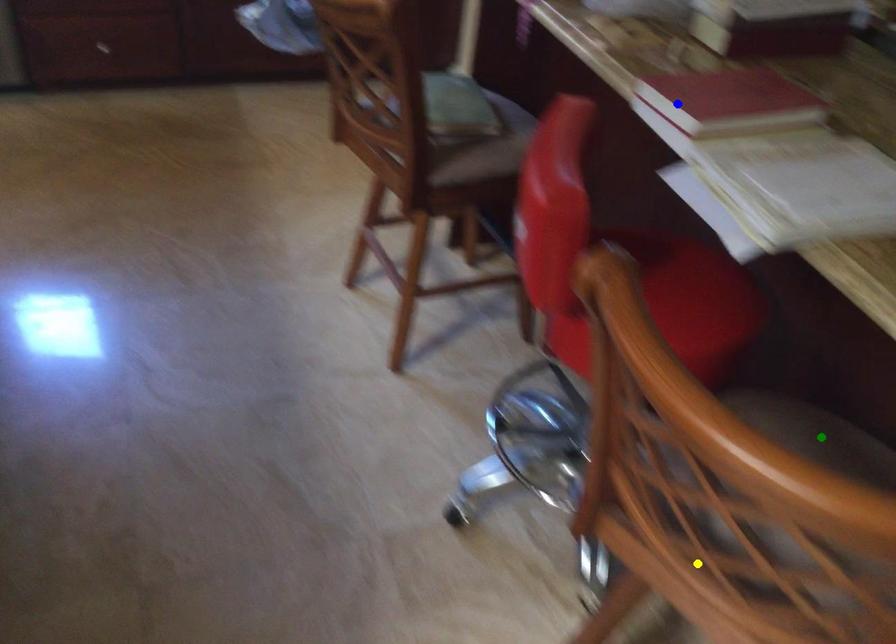
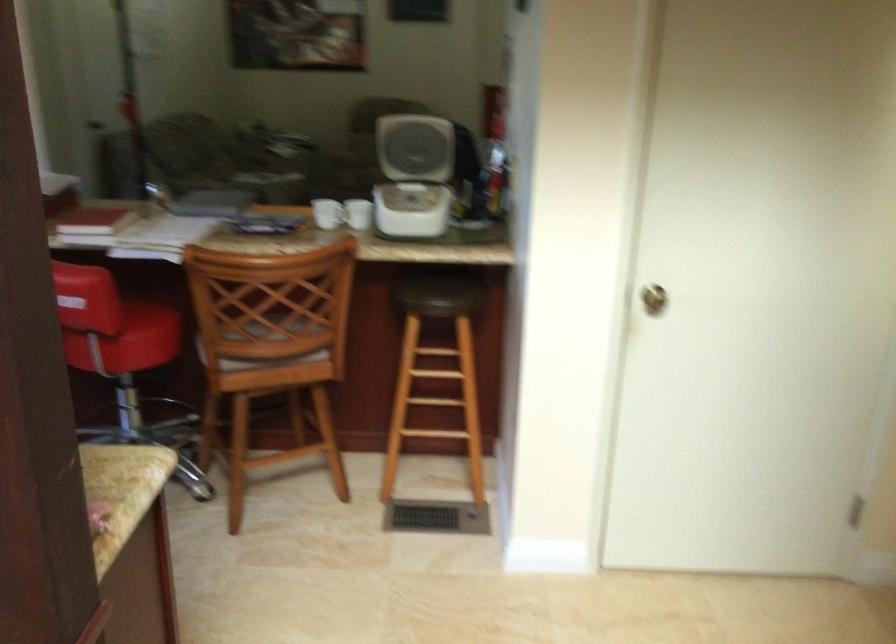
I am providing you with two images of the same scene from different viewpoints. Three points are marked in image1. Which point corresponds to a part or object that is occluded in image2?In image1, three points are marked. Which of them correspond to a part or object that is occluded in image2?Among the three points shown in image1, which one corresponds to a part or object that is no longer visible due to occlusion in image2?

green point